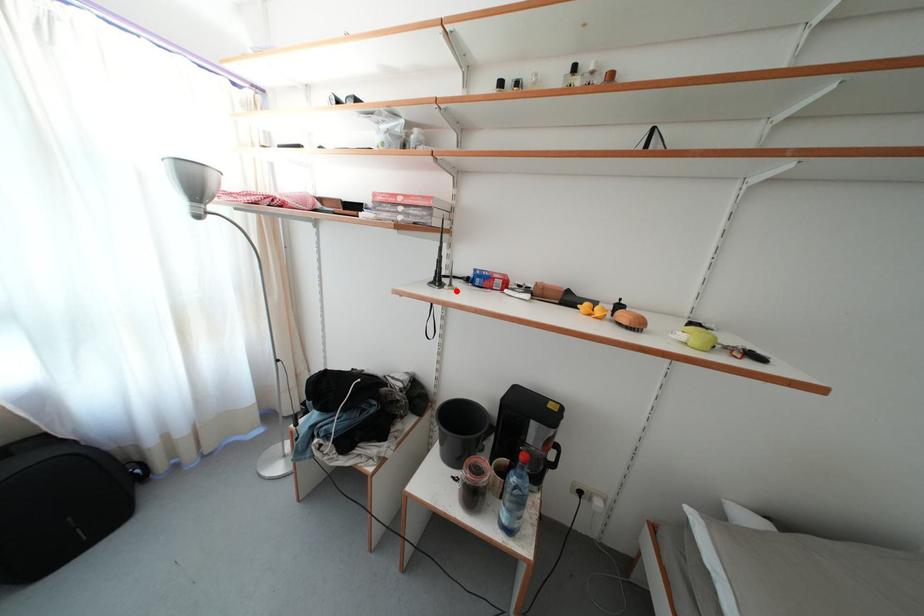
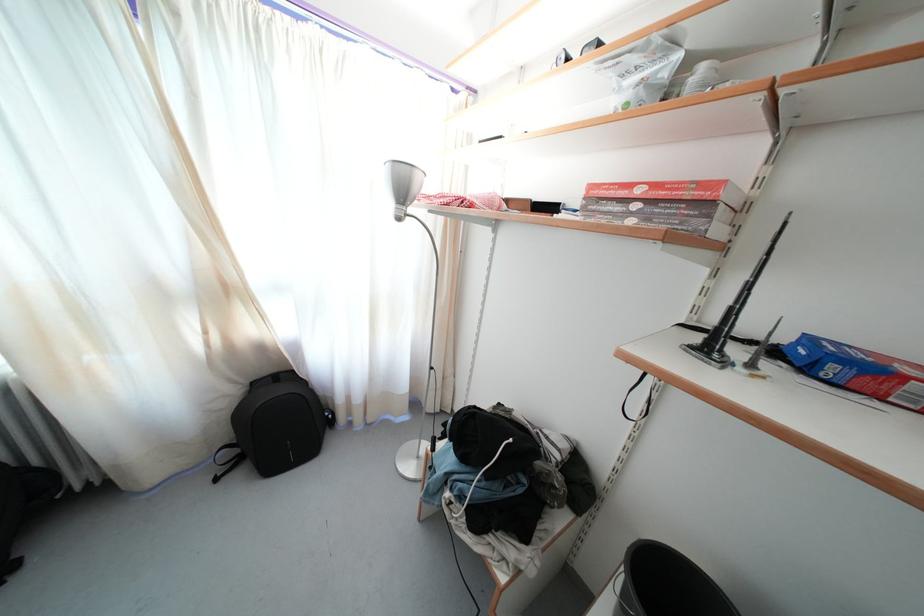
In the second image, find the point that corresponds to the highlighted location in the first image.

(757, 371)